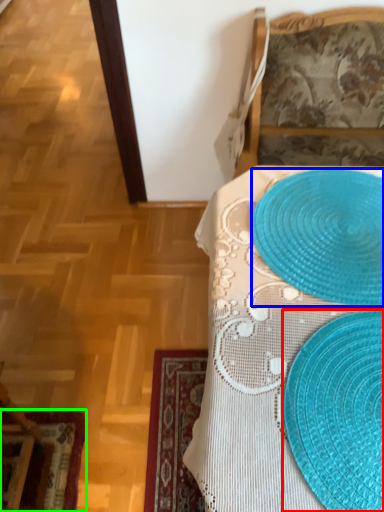
Question: Based on their relative distances, which object is nearer to straw hat (highlighted by a red box)? Choose from platter (highlighted by a blue box) and place mat (highlighted by a green box).

Choices:
 (A) platter
 (B) place mat

Answer: (A)